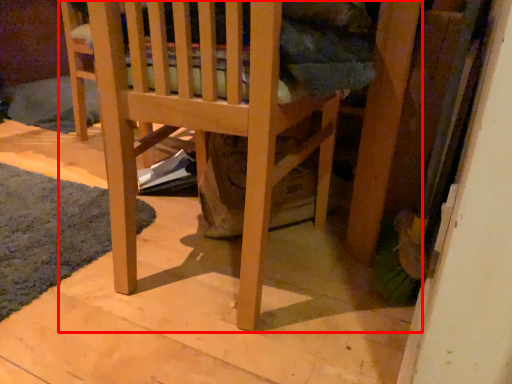
Question: From the image's perspective, where is furniture (annotated by the red box) located in relation to mat in the image?

Choices:
 (A) below
 (B) above

Answer: (B)